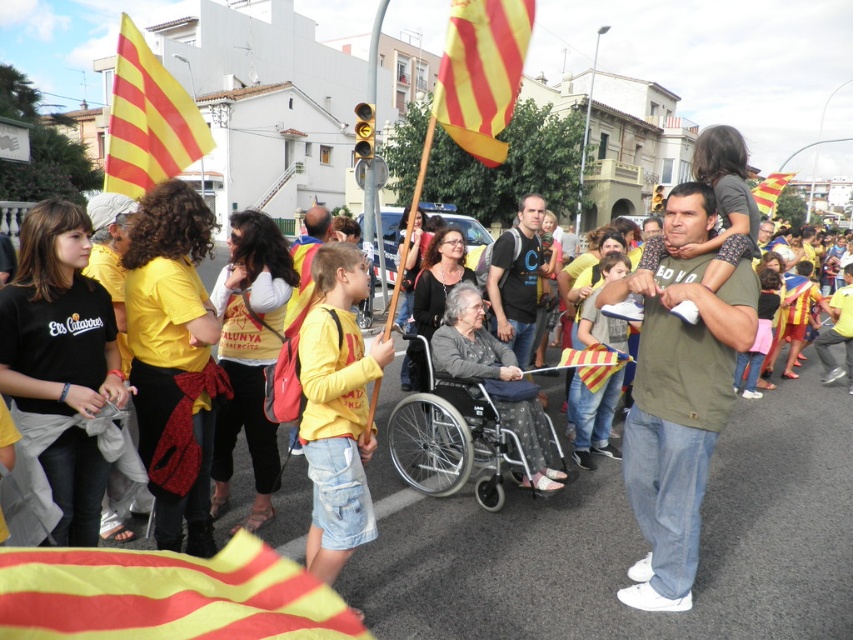
Question: Can you confirm if matte green t-shirt at center is positioned to the right of yellowstriped fabricflag at upper center?

Choices:
 (A) yes
 (B) no

Answer: (A)

Question: Which point is farther to the camera?

Choices:
 (A) (714, 440)
 (B) (523, 292)
 (C) (459, 76)
 (D) (132, 97)

Answer: (B)

Question: Is yellowstriped fabricflag at upper center below dark green t-shirt at center?

Choices:
 (A) no
 (B) yes

Answer: (A)

Question: Does yellowmaterial/textureflag at upper left appear on the right side of yellow and red striped flag at upper right?

Choices:
 (A) no
 (B) yes

Answer: (A)

Question: Which of these objects is positioned farthest from the yellow striped fabric at center?

Choices:
 (A) dark green t-shirt at center
 (B) silver metallic wheelchair at center

Answer: (B)

Question: Which point is closer to the camera?

Choices:
 (A) matte green t-shirt at center
 (B) yellowstriped fabricflag at upper center
 (C) silver metallic wheelchair at center

Answer: (B)